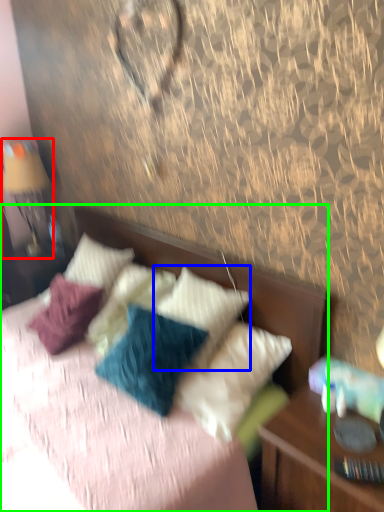
Question: Considering the real-world distances, which object is farthest from bedside lamp (highlighted by a red box)? pillow (highlighted by a blue box) or bed (highlighted by a green box)?

Choices:
 (A) pillow
 (B) bed

Answer: (A)